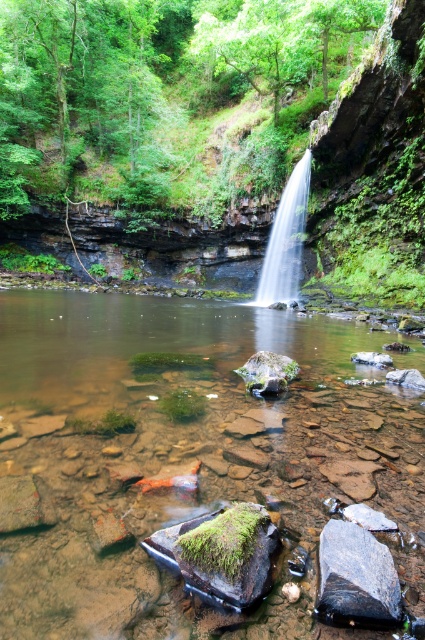
How far apart are clear stone stream at center and clear water at center?

A distance of 58.87 feet exists between clear stone stream at center and clear water at center.

Which is more to the right, clear stone stream at center or clear water at center?

clear water at center is more to the right.

Locate an element on the screen. This screenshot has height=640, width=425. clear stone stream at center is located at coordinates (184, 465).